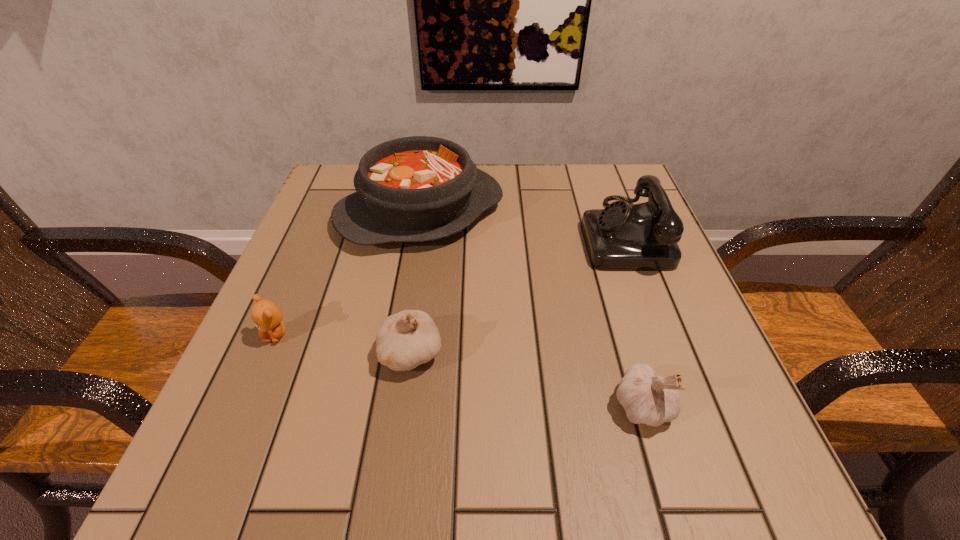
The image size is (960, 540). What are the coordinates of `object located in the far right corner section of the desktop` in the screenshot? It's located at (641, 237).

You are a GUI agent. You are given a task and a screenshot of the screen. Output one action in this format:
    pyautogui.click(x=<x>, y=<y>)
    Task: Click on the vacant space at the far edge of the desktop
    
    Given the screenshot: What is the action you would take?
    pyautogui.click(x=549, y=180)

In the image, there is a desktop. Where is `free space at the near edge`? free space at the near edge is located at coordinates (428, 491).

The image size is (960, 540). What are the coordinates of `vacant region at the left edge` in the screenshot? It's located at (288, 302).

In the image, there is a desktop. Where is `vacant space at the right edge`? vacant space at the right edge is located at coordinates (629, 330).

In the image, there is a desktop. Where is `blank space at the near left corner`? This screenshot has width=960, height=540. blank space at the near left corner is located at coordinates (270, 488).

Identify the location of free space at the far right corner. This screenshot has height=540, width=960. (586, 178).

Locate an element on the screen. vacant space at the near right corner of the desktop is located at coordinates (744, 438).

Where is `unoccupied area between the casserole and the left garlic`? unoccupied area between the casserole and the left garlic is located at coordinates (416, 282).

Where is `vacant space in between the telephone and the teddy bear`? vacant space in between the telephone and the teddy bear is located at coordinates (449, 284).